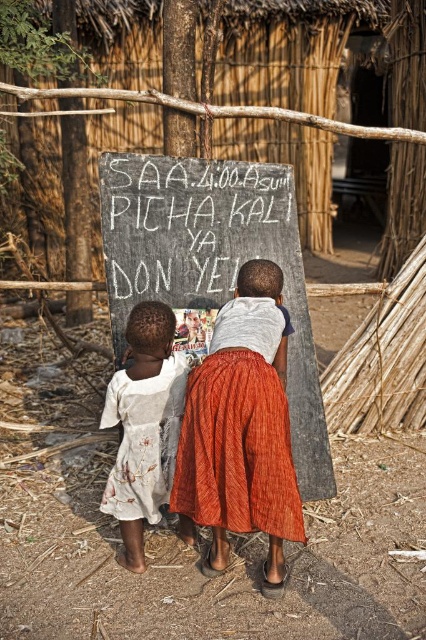
Question: Considering the relative positions of black chalkboard at center and white chalkboard at center in the image provided, where is black chalkboard at center located with respect to white chalkboard at center?

Choices:
 (A) above
 (B) below

Answer: (B)

Question: Which object appears farthest from the camera in this image?

Choices:
 (A) white printed dress at lower left
 (B) orange textured skirt at center
 (C) black chalkboard at center
 (D) white chalkboard at center

Answer: (D)

Question: Does black chalkboard at center have a smaller size compared to orange textured skirt at center?

Choices:
 (A) no
 (B) yes

Answer: (A)

Question: Which of the following is the farthest from the observer?

Choices:
 (A) black chalkboard at center
 (B) white printed dress at lower left
 (C) orange textured skirt at center
 (D) white chalkboard at center

Answer: (D)

Question: Which object is positioned closest to the orange textured skirt at center?

Choices:
 (A) white chalkboard at center
 (B) black chalkboard at center

Answer: (B)

Question: In this image, where is orange textured skirt at center located relative to white printed dress at lower left?

Choices:
 (A) right
 (B) left

Answer: (A)